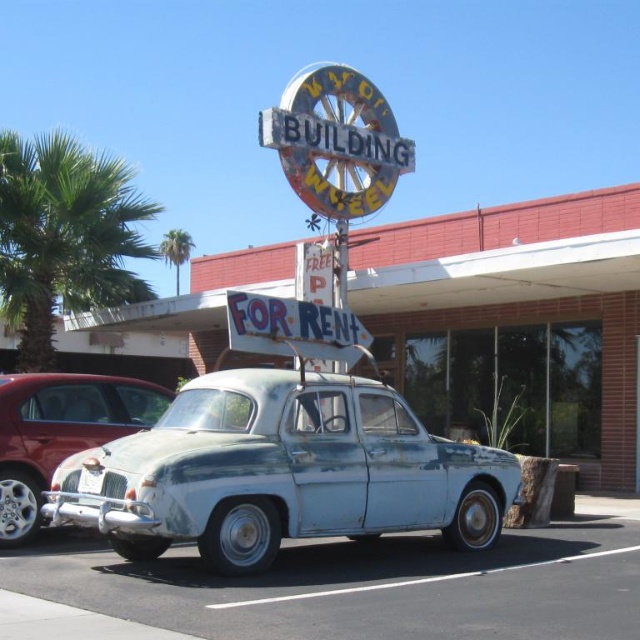
You are standing at the entrance of the VINTAGE WHEEL BUILDING and want to park your car near the rusty metallic car at center. According to the coordinates provided, where should you position your vehicle?

The rusty metallic car at center is located at point (282, 472), so you should position your vehicle near those coordinates to park near it.